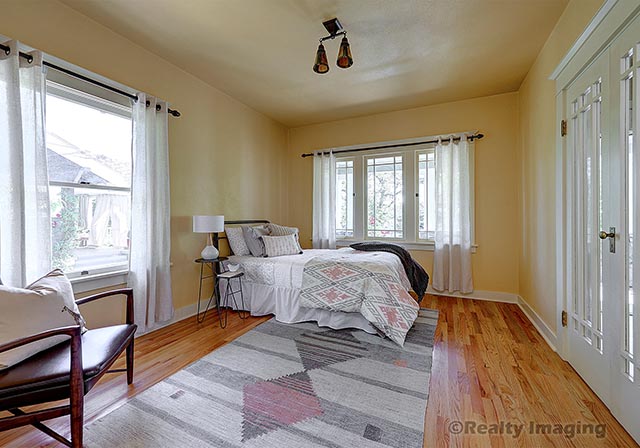
This screenshot has width=640, height=448. I want to click on pillows, so click(284, 232), click(278, 241), click(252, 251), click(240, 249).